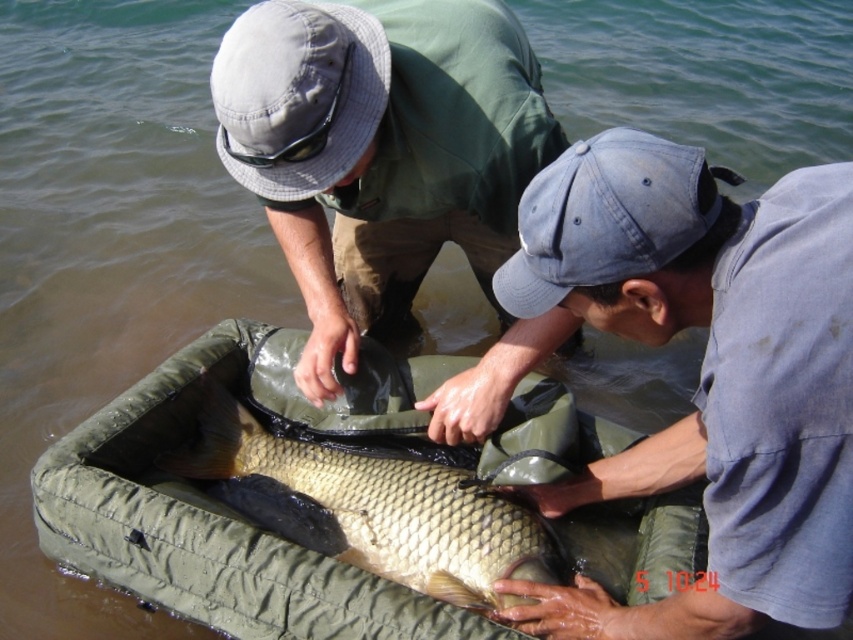
Question: Which object appears closest to the camera in this image?

Choices:
 (A) denim baseball cap at lower right
 (B) blue denim cap at center

Answer: (B)

Question: Estimate the real-world distances between objects in this image. Which object is farther from the denim baseball cap at lower right?

Choices:
 (A) green fabric bag at center
 (B) gray fabric baseball cap at upper center

Answer: (A)

Question: Observing the image, what is the correct spatial positioning of blue denim cap at center in reference to denim baseball cap at lower right?

Choices:
 (A) above
 (B) below

Answer: (B)

Question: Considering the real-world distances, which object is closest to the gray fabric baseball cap at upper center?

Choices:
 (A) shiny gold fish at center
 (B) blue denim cap at center
 (C) denim baseball cap at lower right
 (D) green fabric bag at center

Answer: (D)

Question: Can you confirm if shiny gold fish at center is bigger than denim baseball cap at lower right?

Choices:
 (A) yes
 (B) no

Answer: (A)

Question: Is green fabric bag at center above shiny gold fish at center?

Choices:
 (A) yes
 (B) no

Answer: (A)